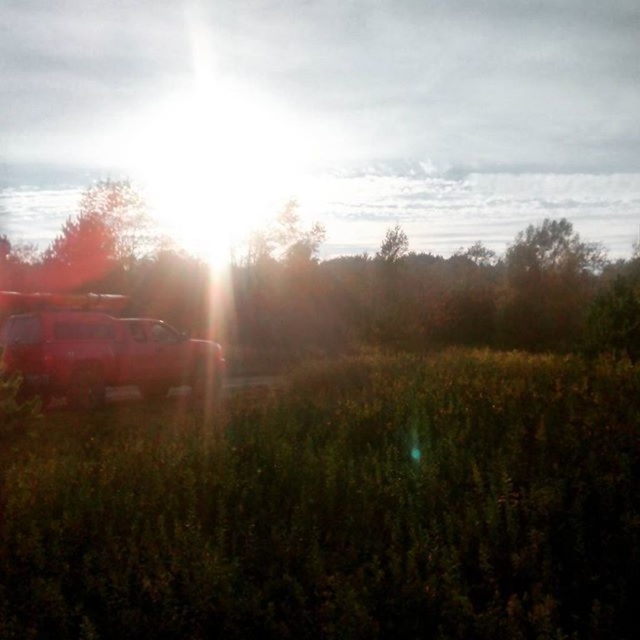
In the scene shown: Is green leafy tree at left positioned before shiny red jeep at left?

No, green leafy tree at left is behind shiny red jeep at left.

Does green leafy tree at left have a larger size compared to shiny red jeep at left?

Correct, green leafy tree at left is larger in size than shiny red jeep at left.

What do you see at coordinates (440, 285) in the screenshot? I see `green leafy tree at left` at bounding box center [440, 285].

Find the location of a particular element. green leafy tree at left is located at coordinates (440, 285).

Who is more distant from viewer, (381, 593) or (636, 353)?

Point (636, 353)

Which is in front, point (388, 474) or point (627, 262)?

Point (388, 474)

Is point (580, 424) positioned behind point (419, 305)?

No, (580, 424) is in front of (419, 305).

What are the coordinates of `green grass at lower left` in the screenshot? It's located at tap(344, 509).

Based on the photo, between green grass at lower left and shiny red jeep at left, which one has less height?

Standing shorter between the two is green grass at lower left.

Consider the image. Who is positioned more to the left, green grass at lower left or shiny red jeep at left?

Positioned to the left is shiny red jeep at left.

I want to click on green grass at lower left, so click(344, 509).